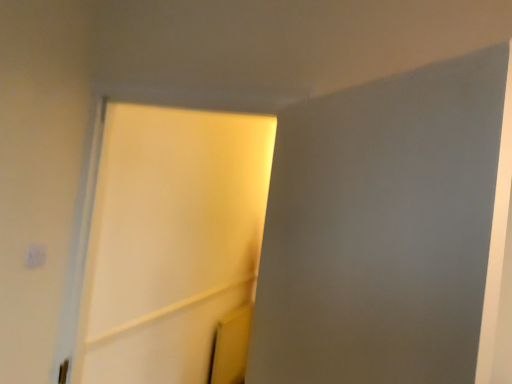
Question: Is white matte screen door at upper center, positioned as the 2th screen door in back-to-front order, completely or partially inside white matte light switch at upper left?

Choices:
 (A) no
 (B) yes

Answer: (A)

Question: From the image's perspective, is white matte light switch at upper left on top of white matte screen door at upper center, positioned as the 2th screen door in back-to-front order?

Choices:
 (A) yes
 (B) no

Answer: (B)

Question: Considering the relative sizes of white matte light switch at upper left and white matte screen door at upper center, positioned as the 2th screen door in back-to-front order, in the image provided, is white matte light switch at upper left smaller than white matte screen door at upper center, positioned as the 2th screen door in back-to-front order,?

Choices:
 (A) yes
 (B) no

Answer: (A)

Question: Is the depth of white matte light switch at upper left greater than that of white matte screen door at upper center, placed as the first screen door when sorted from right to left?

Choices:
 (A) yes
 (B) no

Answer: (A)

Question: Is white matte screen door at upper center, placed as the first screen door when sorted from right to left, at the back of white matte light switch at upper left?

Choices:
 (A) yes
 (B) no

Answer: (B)

Question: From the image's perspective, is white matte screen door at upper center, the first screen door when ordered from front to back, located above or below white matte light switch at upper left?

Choices:
 (A) above
 (B) below

Answer: (A)

Question: In the image, is white matte screen door at upper center, positioned as the 2th screen door in back-to-front order, positioned in front of or behind white matte light switch at upper left?

Choices:
 (A) front
 (B) behind

Answer: (A)

Question: From their relative heights in the image, would you say white matte screen door at upper center, the first screen door when ordered from front to back, is taller or shorter than white matte light switch at upper left?

Choices:
 (A) short
 (B) tall

Answer: (B)

Question: Considering the positions of white matte screen door at upper center, placed as the first screen door when sorted from right to left, and white matte light switch at upper left in the image, is white matte screen door at upper center, placed as the first screen door when sorted from right to left, wider or thinner than white matte light switch at upper left?

Choices:
 (A) wide
 (B) thin

Answer: (A)

Question: Visually, is white matte screen door at upper center, the first screen door when ordered from front to back, positioned to the left or to the right of white matte screen door at center, marked as the 2th screen door in a right-to-left arrangement?

Choices:
 (A) left
 (B) right

Answer: (B)

Question: Is white matte screen door at upper center, the 2th screen door positioned from the left, bigger or smaller than white matte screen door at center, marked as the 2th screen door in a right-to-left arrangement?

Choices:
 (A) big
 (B) small

Answer: (B)

Question: Is white matte screen door at upper center, placed as the first screen door when sorted from right to left, spatially inside white matte screen door at center, which is the first screen door in back-to-front order, or outside of it?

Choices:
 (A) outside
 (B) inside

Answer: (A)

Question: From the image's perspective, is white matte screen door at upper center, the first screen door when ordered from front to back, above or below white matte screen door at center, the 2th screen door viewed from the front?

Choices:
 (A) below
 (B) above

Answer: (B)

Question: From the image's perspective, is white matte light switch at upper left located above or below white matte screen door at center, which is the first screen door in left-to-right order?

Choices:
 (A) above
 (B) below

Answer: (B)

Question: Does point (36, 253) appear closer or farther from the camera than point (205, 233)?

Choices:
 (A) farther
 (B) closer

Answer: (B)